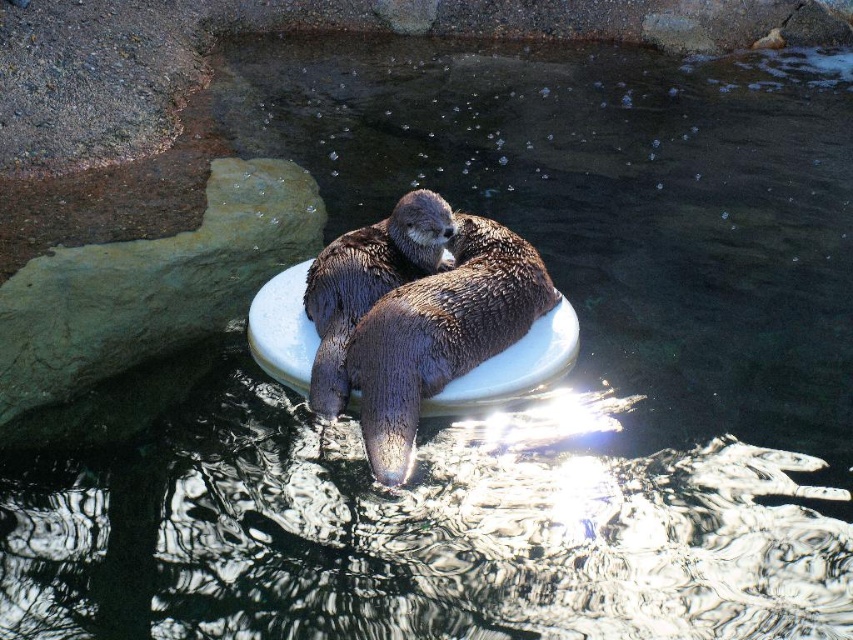
Describe the element at coordinates (440, 333) in the screenshot. I see `brown fuzzy otter at center` at that location.

Consider the image. Does brown fuzzy otter at center appear on the right side of shiny brown otter at center?

Correct, you'll find brown fuzzy otter at center to the right of shiny brown otter at center.

The image size is (853, 640). Describe the element at coordinates (440, 333) in the screenshot. I see `brown fuzzy otter at center` at that location.

Find the location of a particular element. This screenshot has height=640, width=853. brown fuzzy otter at center is located at coordinates (440, 333).